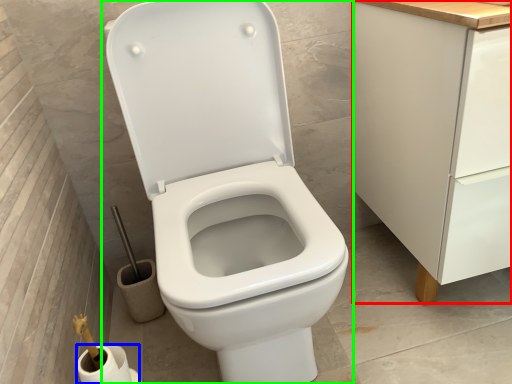
Question: Which object is the farthest from cabinetry (highlighted by a red box)? Choose among these: toilet paper (highlighted by a blue box) or toilet (highlighted by a green box).

Choices:
 (A) toilet paper
 (B) toilet

Answer: (A)